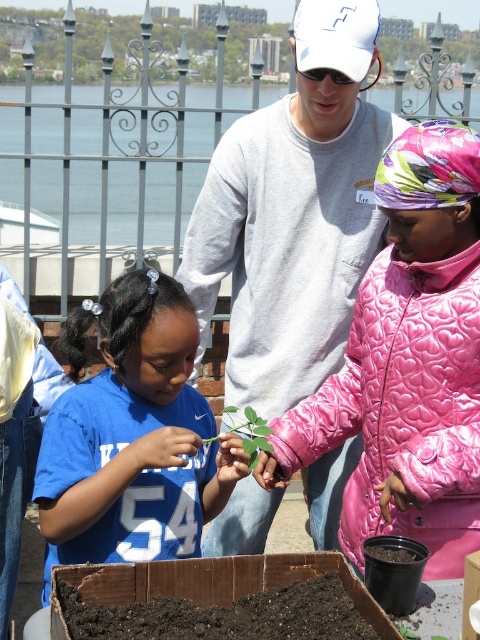
In the scene shown: Can you confirm if pink quilted jacket at center is wider than blue jersey at center?

No, pink quilted jacket at center is not wider than blue jersey at center.

Is point (439, 307) in front of point (141, 378)?

Yes, point (439, 307) is in front of point (141, 378).

Identify the location of pink quilted jacket at center. Image resolution: width=480 pixels, height=640 pixels. (408, 362).

From the picture: Who is lower down, gray sweatshirt at center or blue jersey at center?

Positioned lower is blue jersey at center.

The width and height of the screenshot is (480, 640). What are the coordinates of `gray sweatshirt at center` in the screenshot? It's located at (294, 214).

Does gray sweatshirt at center come in front of pink quilted jacket at center?

No.

From the picture: Does gray sweatshirt at center appear on the left side of pink quilted jacket at center?

Yes, gray sweatshirt at center is to the left of pink quilted jacket at center.

Between point (205, 189) and point (463, 547), which one is positioned behind?

Positioned behind is point (205, 189).

Find the location of `gray sweatshirt at center`. gray sweatshirt at center is located at coordinates (294, 214).